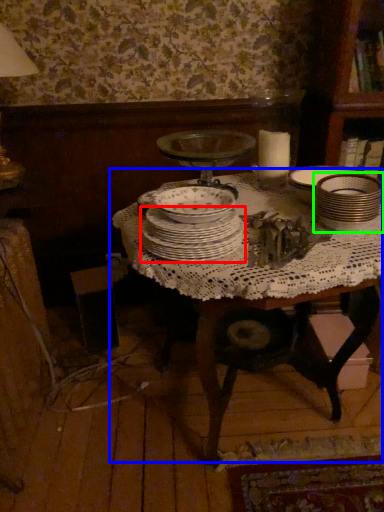
Question: Which is farther away from plate (highlighted by a red box)? table (highlighted by a blue box) or tableware (highlighted by a green box)?

Choices:
 (A) table
 (B) tableware

Answer: (B)